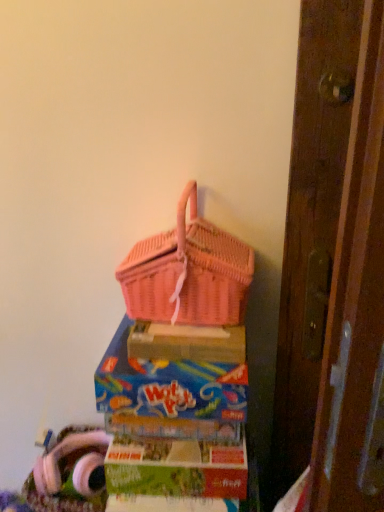
Question: Can you confirm if pink wicker picnic basket at upper center is thinner than pink wicker basket at upper center, placed as the first box when sorted from top to bottom?

Choices:
 (A) no
 (B) yes

Answer: (B)

Question: Can you confirm if pink wicker picnic basket at upper center is shorter than pink wicker basket at upper center, placed as the first box when sorted from top to bottom?

Choices:
 (A) no
 (B) yes

Answer: (A)

Question: Does pink wicker picnic basket at upper center turn towards pink wicker basket at upper center, placed as the first box when sorted from top to bottom?

Choices:
 (A) yes
 (B) no

Answer: (B)

Question: Is pink wicker picnic basket at upper center not near pink wicker basket at upper center, the second box from the bottom?

Choices:
 (A) yes
 (B) no

Answer: (B)

Question: From the image's perspective, does pink wicker picnic basket at upper center appear lower than pink wicker basket at upper center, placed as the first box when sorted from top to bottom?

Choices:
 (A) no
 (B) yes

Answer: (A)

Question: Is pink wicker picnic basket at upper center facing away from pink wicker basket at upper center, the second box from the bottom?

Choices:
 (A) yes
 (B) no

Answer: (B)

Question: From the image's perspective, is pink wicker basket at upper center, the second box from the bottom, above matte cardboard box at lower center, which ranks as the 2th box in top-to-bottom order?

Choices:
 (A) no
 (B) yes

Answer: (B)

Question: Can you confirm if pink wicker basket at upper center, placed as the first box when sorted from top to bottom, is positioned to the left of matte cardboard box at lower center, which ranks as the 2th box in top-to-bottom order?

Choices:
 (A) yes
 (B) no

Answer: (A)

Question: Is pink wicker basket at upper center, placed as the first box when sorted from top to bottom, positioned in front of matte cardboard box at lower center, which ranks as the 2th box in top-to-bottom order?

Choices:
 (A) no
 (B) yes

Answer: (B)

Question: From a real-world perspective, is pink wicker basket at upper center, placed as the first box when sorted from top to bottom, under matte cardboard box at lower center, which ranks as the 2th box in top-to-bottom order?

Choices:
 (A) yes
 (B) no

Answer: (B)

Question: Considering the relative sizes of pink wicker basket at upper center, the second box from the bottom, and matte cardboard box at lower center, which ranks as the 2th box in top-to-bottom order, in the image provided, is pink wicker basket at upper center, the second box from the bottom, thinner than matte cardboard box at lower center, which ranks as the 2th box in top-to-bottom order,?

Choices:
 (A) yes
 (B) no

Answer: (B)

Question: Is pink wicker basket at upper center, placed as the first box when sorted from top to bottom, completely or partially outside of matte cardboard box at lower center, which ranks as the 2th box in top-to-bottom order?

Choices:
 (A) no
 (B) yes

Answer: (B)

Question: From a real-world perspective, is matte cardboard box at lower center, which ranks as the 1th box in bottom-to-top order, on top of pink wicker basket at upper center, the second box from the bottom?

Choices:
 (A) no
 (B) yes

Answer: (A)